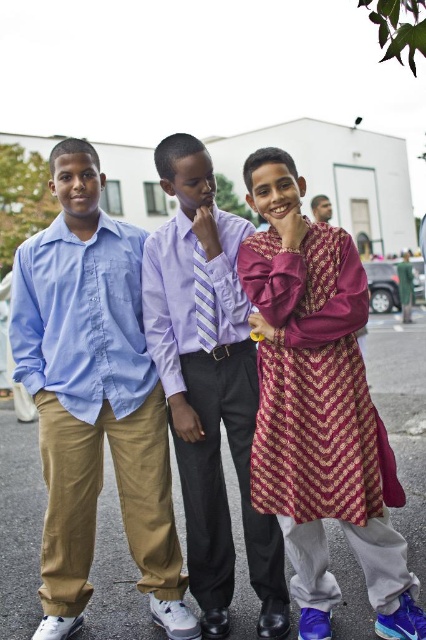
Question: Estimate the real-world distances between objects in this image. Which object is farther from the light blue cotton shirt at center?

Choices:
 (A) gold textured fabric at center
 (B) maroon patterned kurta at center
 (C) striped tie at center

Answer: (A)

Question: Does striped tie at center have a greater width compared to purple striped tie at center?

Choices:
 (A) no
 (B) yes

Answer: (B)

Question: Which point is farther to the camera?

Choices:
 (A) (199, 269)
 (B) (189, 256)
 (C) (319, 204)

Answer: (C)

Question: Considering the relative positions of maroon patterned kurta at center and striped tie at center in the image provided, where is maroon patterned kurta at center located with respect to striped tie at center?

Choices:
 (A) left
 (B) right

Answer: (B)

Question: Considering the relative positions of maroon patterned kurta at center and striped tie at center in the image provided, where is maroon patterned kurta at center located with respect to striped tie at center?

Choices:
 (A) left
 (B) right

Answer: (B)

Question: Among these points, which one is farthest from the camera?

Choices:
 (A) (89, 284)
 (B) (299, 378)
 (C) (204, 264)

Answer: (C)